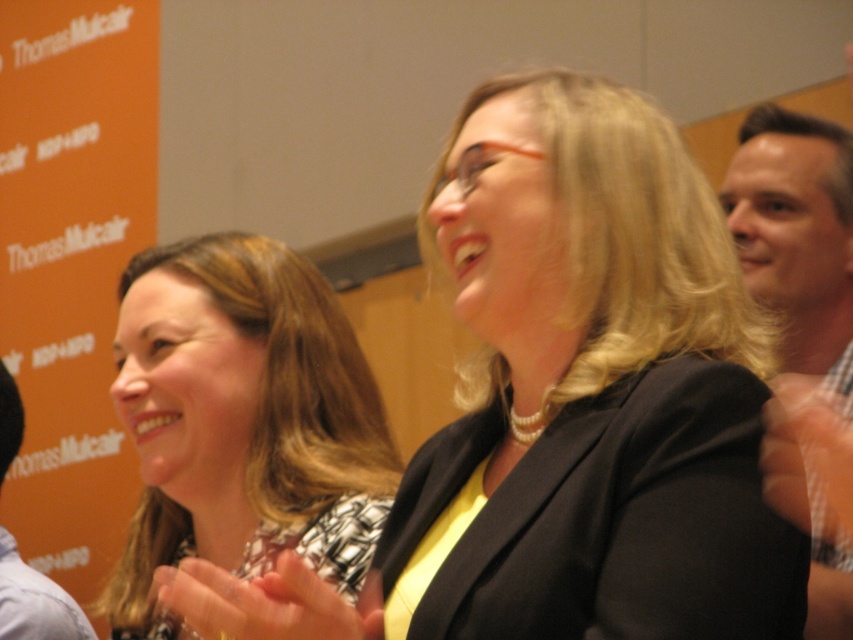
Question: Which point is closer to the camera?

Choices:
 (A) (236, 394)
 (B) (515, 497)

Answer: (B)

Question: Is black matte blazer at center further to the viewer compared to blonde hair at center?

Choices:
 (A) no
 (B) yes

Answer: (A)

Question: Is black matte blazer at center wider than blonde hair at center?

Choices:
 (A) no
 (B) yes

Answer: (B)

Question: Among these objects, which one is nearest to the camera?

Choices:
 (A) black matte blazer at center
 (B) blonde hair at center

Answer: (A)

Question: Where is black matte blazer at center located in relation to blonde hair at center in the image?

Choices:
 (A) below
 (B) above

Answer: (B)